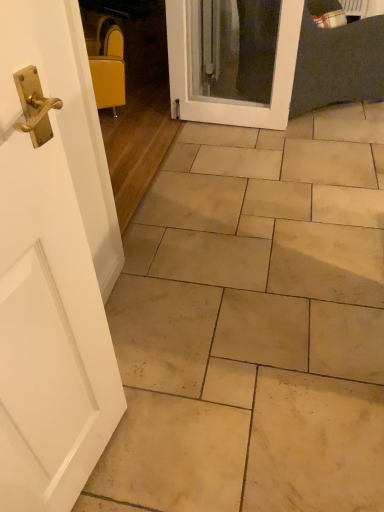
In order to click on free location in front of white glossy door at center in this screenshot , I will do `click(234, 154)`.